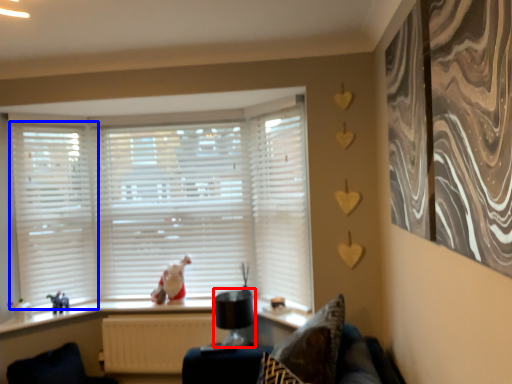
Question: Which object appears farthest to the camera in this image, lamp (highlighted by a red box) or shutter (highlighted by a blue box)?

Choices:
 (A) lamp
 (B) shutter

Answer: (B)